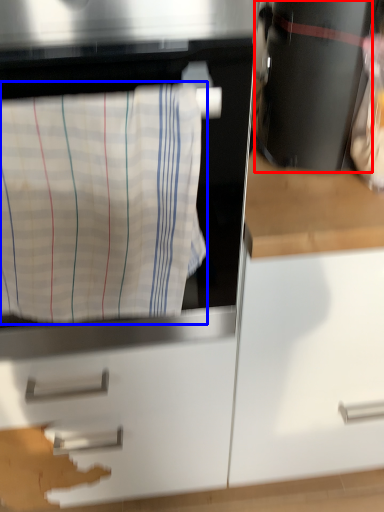
Question: Which point is further to the camera, appliance (highlighted by a red box) or laundry (highlighted by a blue box)?

Choices:
 (A) appliance
 (B) laundry

Answer: (A)